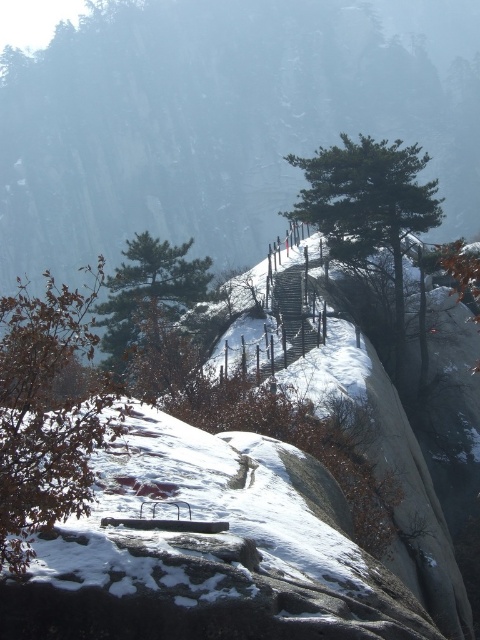
Question: Which is nearer to the green matte tree at upper center?

Choices:
 (A) brown matte tree at lower left
 (B) green matte tree at center

Answer: (B)

Question: Which of the following is the farthest from the observer?

Choices:
 (A) (38, 358)
 (B) (156, 326)
 (C) (394, 273)

Answer: (C)

Question: Does brown matte tree at lower left have a larger size compared to green matte tree at center?

Choices:
 (A) no
 (B) yes

Answer: (B)

Question: Is brown matte tree at lower left wider than green matte tree at upper center?

Choices:
 (A) no
 (B) yes

Answer: (B)

Question: Is brown matte tree at lower left thinner than green matte tree at center?

Choices:
 (A) no
 (B) yes

Answer: (A)

Question: Which point is farther from the camera taking this photo?

Choices:
 (A) (24, 324)
 (B) (162, 266)

Answer: (B)